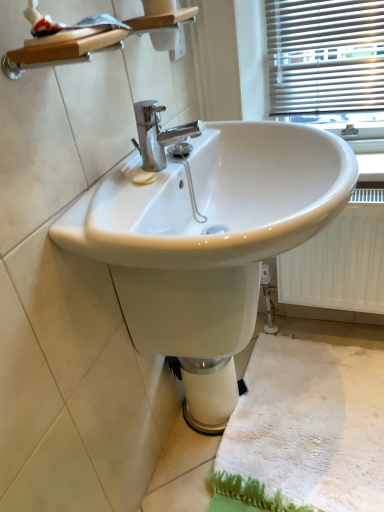
Question: Considering the positions of point (201, 259) and point (317, 242), is point (201, 259) closer or farther from the camera than point (317, 242)?

Choices:
 (A) farther
 (B) closer

Answer: (B)

Question: Which is correct: white glossy sink at center is inside white textured radiator at lower right, or outside of it?

Choices:
 (A) inside
 (B) outside

Answer: (B)

Question: Based on their relative distances, which object is farther from the white fluffy bath mat at lower right?

Choices:
 (A) white textured radiator at lower right
 (B) white glossy sink at center

Answer: (B)

Question: Which of these objects is positioned farthest from the white glossy sink at center?

Choices:
 (A) white fluffy bath mat at lower right
 (B) white textured radiator at lower right

Answer: (A)